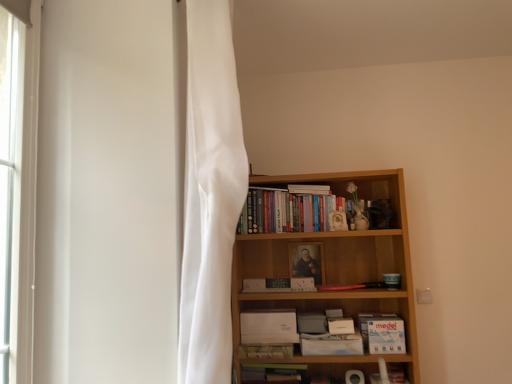
Question: Are white matte paperback book at lower center, which is the 2th paperback book in left-to-right order, and white sheer curtain at left located far from each other?

Choices:
 (A) yes
 (B) no

Answer: (A)

Question: Is white matte paperback book at lower center, which is the 2th paperback book in left-to-right order, further to the viewer compared to white sheer curtain at left?

Choices:
 (A) no
 (B) yes

Answer: (B)

Question: Could white sheer curtain at left be considered to be inside white matte paperback book at lower center, which is the 2th paperback book in left-to-right order?

Choices:
 (A) yes
 (B) no

Answer: (B)

Question: Is white matte paperback book at lower center, placed as the 5th paperback book when sorted from right to left, located outside white sheer curtain at left?

Choices:
 (A) yes
 (B) no

Answer: (A)

Question: Is white matte paperback book at lower center, placed as the 5th paperback book when sorted from right to left, taller than white sheer curtain at left?

Choices:
 (A) no
 (B) yes

Answer: (A)

Question: Can you confirm if white matte paperback book at lower center, placed as the 5th paperback book when sorted from right to left, is positioned to the left of white sheer curtain at left?

Choices:
 (A) no
 (B) yes

Answer: (A)

Question: Are white paper book at upper center, placed as the 1th book when sorted from top to bottom, and white matte paperback book at lower right, positioned as the 1th paperback book in right-to-left order, making contact?

Choices:
 (A) no
 (B) yes

Answer: (A)

Question: Are white paper book at upper center, placed as the 1th book when sorted from top to bottom, and white matte paperback book at lower right, the 6th paperback book viewed from the left, located far from each other?

Choices:
 (A) no
 (B) yes

Answer: (A)

Question: From a real-world perspective, does white paper book at upper center, placed as the 1th book when sorted from top to bottom, stand above white matte paperback book at lower right, the 6th paperback book viewed from the left?

Choices:
 (A) no
 (B) yes

Answer: (B)

Question: Is white paper book at upper center, the 3th book positioned from the bottom, aimed at white matte paperback book at lower right, positioned as the 1th paperback book in right-to-left order?

Choices:
 (A) no
 (B) yes

Answer: (A)

Question: Can you confirm if white paper book at upper center, placed as the 1th book when sorted from top to bottom, is bigger than white matte paperback book at lower right, positioned as the 1th paperback book in right-to-left order?

Choices:
 (A) no
 (B) yes

Answer: (A)

Question: From a real-world perspective, is white paper book at upper center, placed as the 1th book when sorted from top to bottom, positioned under white matte paperback book at lower right, the 6th paperback book viewed from the left, based on gravity?

Choices:
 (A) no
 (B) yes

Answer: (A)

Question: Is white sheer curtain at left positioned far away from matte white paperback book at center, placed as the 3th paperback book when sorted from left to right?

Choices:
 (A) yes
 (B) no

Answer: (A)